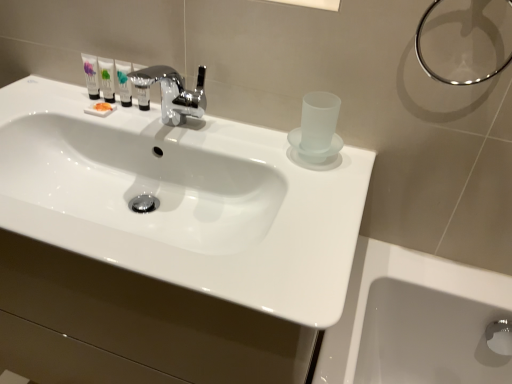
Where is `free space to the right of satin silver bottle at center, which ranks as the 4th mouthwash in left-to-right order`? free space to the right of satin silver bottle at center, which ranks as the 4th mouthwash in left-to-right order is located at coordinates (200, 130).